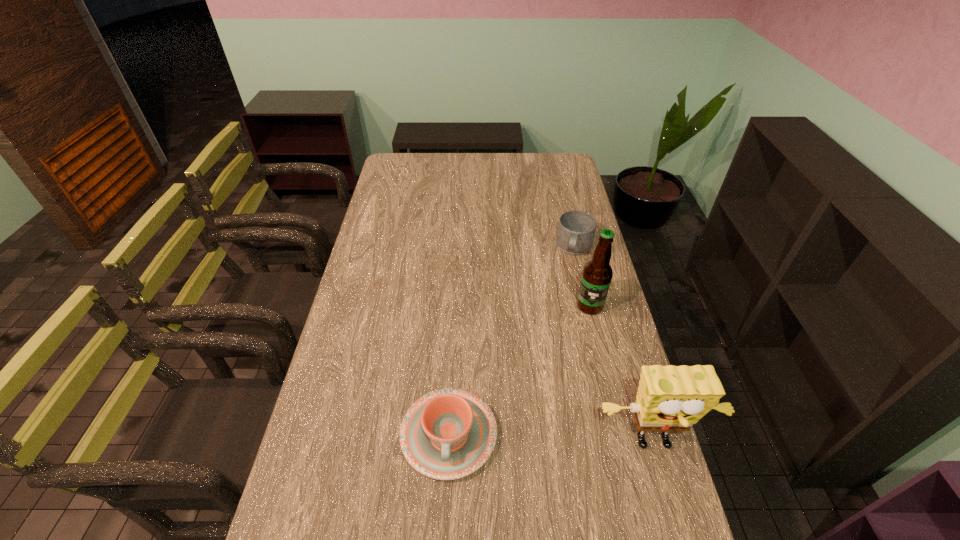
Locate an element on the screen. the leftmost object is located at coordinates (447, 434).

Where is `the second tallest object`? This screenshot has width=960, height=540. the second tallest object is located at coordinates (670, 398).

This screenshot has height=540, width=960. Find the location of `beer bottle`. beer bottle is located at coordinates (597, 274).

Where is `mug`? mug is located at coordinates (576, 230).

Find the location of a particular element. This screenshot has width=960, height=540. vacant space situated 0.050m on the handle side of the chinaware is located at coordinates pos(445,506).

The image size is (960, 540). Find the location of `vacant space positioned 0.080m on the front-facing side of the second tallest object`. vacant space positioned 0.080m on the front-facing side of the second tallest object is located at coordinates (671, 502).

Locate an element on the screen. blank space located 0.280m on the label of the second farthest object is located at coordinates (560, 382).

The width and height of the screenshot is (960, 540). I want to click on vacant space located on the label of the second farthest object, so click(560, 382).

Where is `free space located on the label of the second farthest object`? Image resolution: width=960 pixels, height=540 pixels. free space located on the label of the second farthest object is located at coordinates (571, 354).

The image size is (960, 540). In order to click on free region located 0.100m on the side of the farthest object with the handle in this screenshot , I will do `click(568, 281)`.